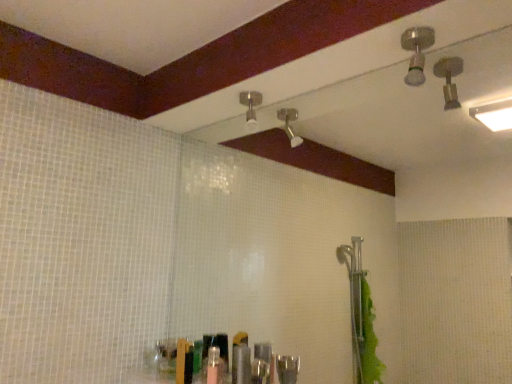
Question: From the image's perspective, is brushed metal shower head at upper right, marked as the 2th shower in a back-to-front arrangement, on metallic silver toiletries at center?

Choices:
 (A) no
 (B) yes

Answer: (B)

Question: Is brushed metal shower head at upper right, acting as the first shower starting from the right, turned away from metallic silver toiletries at center?

Choices:
 (A) yes
 (B) no

Answer: (B)

Question: Does brushed metal shower head at upper right, positioned as the 1th shower in front-to-back order, have a lesser width compared to metallic silver toiletries at center?

Choices:
 (A) no
 (B) yes

Answer: (A)

Question: Is brushed metal shower head at upper right, marked as the 2th shower in a back-to-front arrangement, completely or partially outside of metallic silver toiletries at center?

Choices:
 (A) yes
 (B) no

Answer: (A)

Question: From a real-world perspective, is brushed metal shower head at upper right, positioned as the 1th shower in front-to-back order, under metallic silver toiletries at center?

Choices:
 (A) yes
 (B) no

Answer: (B)

Question: Based on their sizes in the image, would you say brushed metal shower head at upper right, marked as the 2th shower in a back-to-front arrangement, is bigger or smaller than matte silver shower head at upper center, the 2th shower in the front-to-back sequence?

Choices:
 (A) small
 (B) big

Answer: (A)

Question: Would you say brushed metal shower head at upper right, acting as the first shower starting from the right, is to the left or to the right of matte silver shower head at upper center, the 2th shower in the front-to-back sequence, in the picture?

Choices:
 (A) right
 (B) left

Answer: (A)

Question: Relative to matte silver shower head at upper center, the 2th shower in the front-to-back sequence, is brushed metal shower head at upper right, marked as the 2th shower in a back-to-front arrangement, in front or behind?

Choices:
 (A) behind
 (B) front

Answer: (B)

Question: From a real-world perspective, is brushed metal shower head at upper right, positioned as the 1th shower in front-to-back order, positioned above or below matte silver shower head at upper center, the 2th shower in the front-to-back sequence?

Choices:
 (A) below
 (B) above

Answer: (B)

Question: From their relative heights in the image, would you say brushed metal shower head at upper right, acting as the 2th shower starting from the left, is taller or shorter than metallic silver toiletries at center?

Choices:
 (A) tall
 (B) short

Answer: (B)

Question: Looking at their shapes, would you say brushed metal shower head at upper right, positioned as the 1th shower in front-to-back order, is wider or thinner than metallic silver toiletries at center?

Choices:
 (A) thin
 (B) wide

Answer: (B)

Question: In the image, is brushed metal shower head at upper right, acting as the 2th shower starting from the left, positioned in front of or behind metallic silver toiletries at center?

Choices:
 (A) behind
 (B) front

Answer: (B)

Question: Is brushed metal shower head at upper right, positioned as the 1th shower in front-to-back order, situated inside metallic silver toiletries at center or outside?

Choices:
 (A) outside
 (B) inside

Answer: (A)

Question: Does point (254, 105) appear closer or farther from the camera than point (407, 82)?

Choices:
 (A) farther
 (B) closer

Answer: (A)

Question: From the image's perspective, is matte silver shower head at upper center, the 2th shower positioned from the right, above or below brushed metal shower head at upper right, marked as the 2th shower in a back-to-front arrangement?

Choices:
 (A) above
 (B) below

Answer: (B)